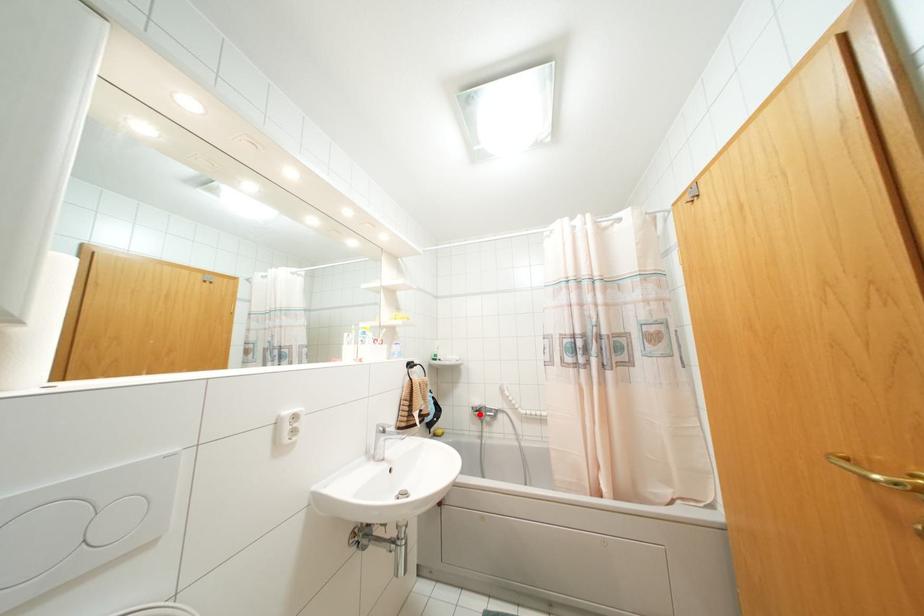
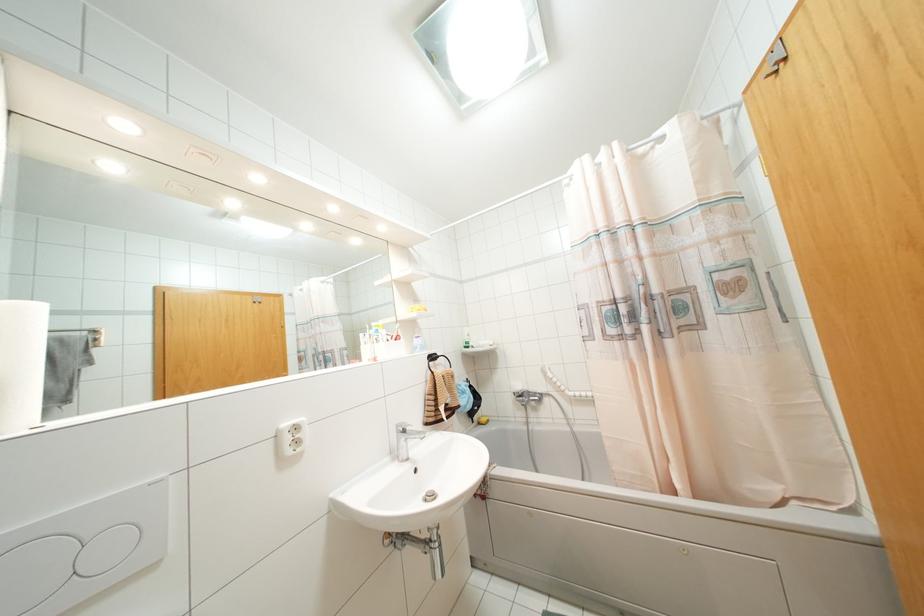
Where in the second image is the point corresponding to the highlighted location from the first image?

(523, 400)